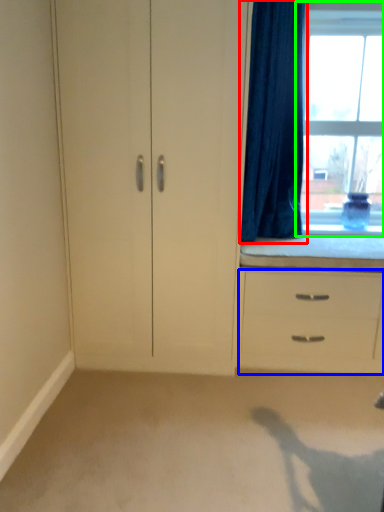
Question: Which is nearer to the curtain (highlighted by a red box)? chest of drawers (highlighted by a blue box) or window (highlighted by a green box).

Choices:
 (A) chest of drawers
 (B) window

Answer: (B)